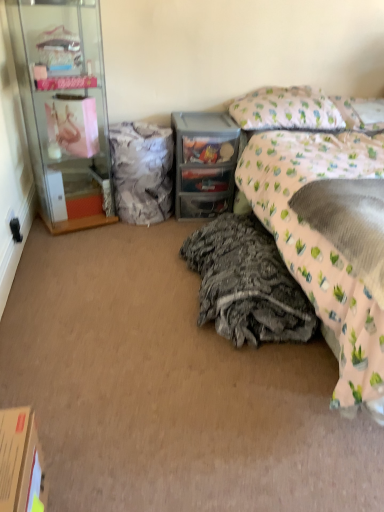
Where is `vacant space that's between clear glass cabinet at left and textured gray blanket at lower center, which is the second material in back-to-front order`? The image size is (384, 512). vacant space that's between clear glass cabinet at left and textured gray blanket at lower center, which is the second material in back-to-front order is located at coordinates (x=132, y=264).